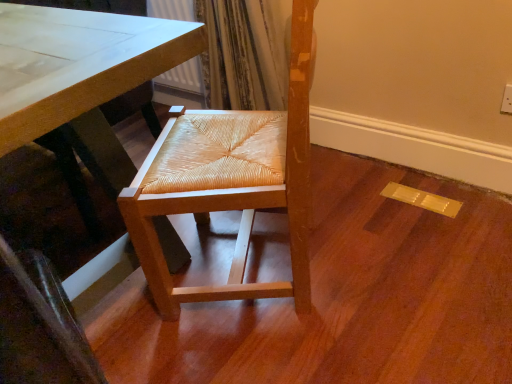
Locate an element on the screen. The height and width of the screenshot is (384, 512). vacant space to the right of natural wood woven seat at center is located at coordinates (404, 247).